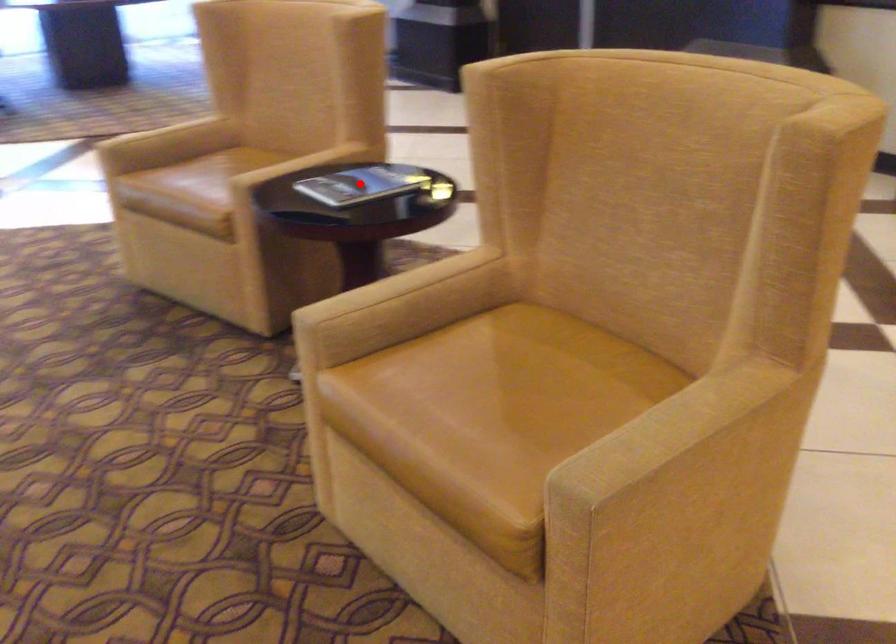
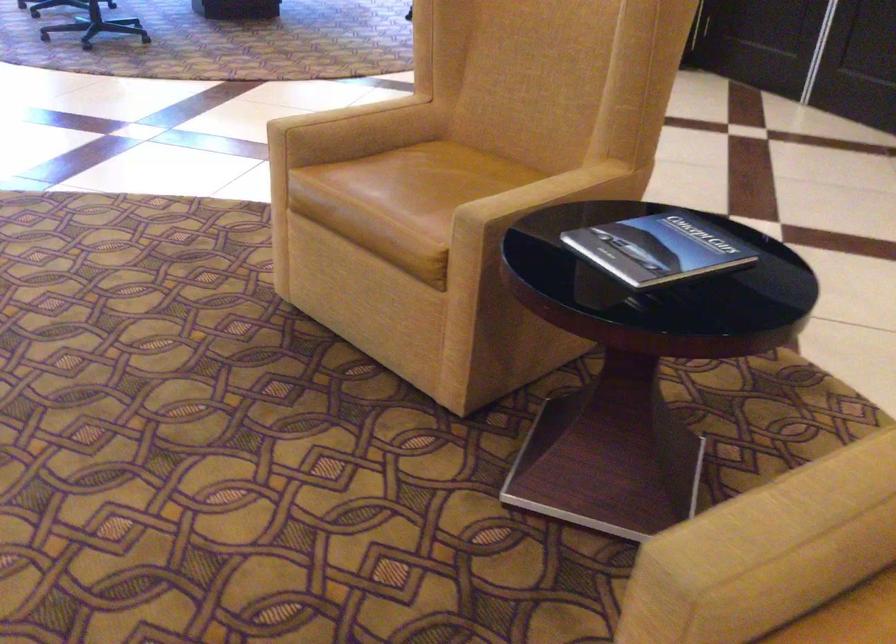
Question: I am providing you with two images of the same scene from different viewpoints. A red point is shown in image1. For the corresponding object point in image2, is it positioned nearer or farther from the camera?

Choices:
 (A) Nearer
 (B) Farther

Answer: (A)